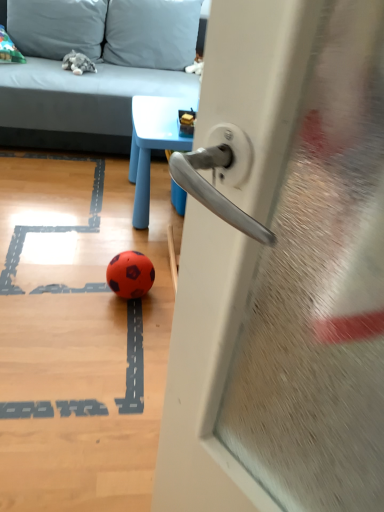
Image resolution: width=384 pixels, height=512 pixels. I want to click on vacant space behind rubber soccer ball at center, so click(132, 250).